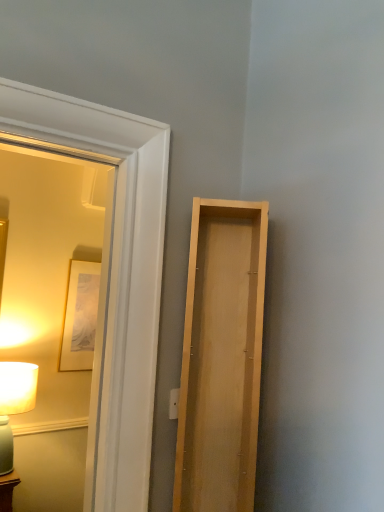
What is the approximate width of light wood door at right?

light wood door at right is 7.26 inches in width.

This screenshot has width=384, height=512. What do you see at coordinates (48, 313) in the screenshot? I see `matte wooden mirror at left` at bounding box center [48, 313].

This screenshot has width=384, height=512. Find the location of `light wood door at right`. light wood door at right is located at coordinates (221, 357).

Locate an element on the screen. Image resolution: width=384 pixels, height=512 pixels. door positioned vertically above the matte white lamp at left (from a real-world perspective) is located at coordinates (221, 357).

Is there a large distance between matte white lamp at left and light wood door at right?

Yes, matte white lamp at left is far from light wood door at right.

From a real-world perspective, is matte white lamp at left positioned above or below light wood door at right?

From a real-world perspective, matte white lamp at left is physically below light wood door at right.

From the picture: How different are the orientations of matte white lamp at left and light wood door at right in degrees?

The angle between the facing direction of matte white lamp at left and the facing direction of light wood door at right is 31.7 degrees.

How many degrees apart are the facing directions of matte wooden mirror at left and light wood door at right?

The facing directions of matte wooden mirror at left and light wood door at right are 32.5 degrees apart.

From the image's perspective, is matte wooden mirror at left beneath light wood door at right?

No, from the image's perspective, matte wooden mirror at left is not below light wood door at right.

From a real-world perspective, who is located lower, matte wooden mirror at left or light wood door at right?

light wood door at right is physically lower.

The image size is (384, 512). I want to click on mirror on the left of light wood door at right, so click(48, 313).

Considering the sizes of objects matte white lamp at left and matte wooden mirror at left in the image provided, who is thinner, matte white lamp at left or matte wooden mirror at left?

With smaller width is matte wooden mirror at left.

Measure the distance from matte white lamp at left to matte wooden mirror at left.

matte white lamp at left is 21.87 inches away from matte wooden mirror at left.

What are the coordinates of `table lamp below the matte wooden mirror at left (from a real-world perspective)` in the screenshot? It's located at (14, 403).

Who is bigger, matte white lamp at left or matte wooden mirror at left?

Bigger between the two is matte wooden mirror at left.

Consider the image. Is there a large distance between light wood door at right and matte wooden mirror at left?

That's right, there is a large distance between light wood door at right and matte wooden mirror at left.

Would you say light wood door at right is to the left or to the right of matte wooden mirror at left in the picture?

Clearly, light wood door at right is on the right of matte wooden mirror at left in the image.

Are matte wooden mirror at left and matte white lamp at left beside each other?

No, matte wooden mirror at left is not in contact with matte white lamp at left.

Can you tell me how much matte wooden mirror at left and matte white lamp at left differ in facing direction?

The facing directions of matte wooden mirror at left and matte white lamp at left are 0.854 degrees apart.

Based on the photo, from a real-world perspective, between matte wooden mirror at left and matte white lamp at left, who is vertically lower?

In real-world perspective, matte white lamp at left is lower.

This screenshot has height=512, width=384. In order to click on mirror above the matte white lamp at left (from the image's perspective) in this screenshot , I will do `click(48, 313)`.

Are light wood door at right and matte white lamp at left far apart?

Indeed, light wood door at right is not near matte white lamp at left.

Does light wood door at right have a greater width compared to matte white lamp at left?

Incorrect, the width of light wood door at right does not surpass that of matte white lamp at left.

Does light wood door at right appear on the right side of matte white lamp at left?

Yes.

What's the angular difference between light wood door at right and matte white lamp at left's facing directions?

The facing directions of light wood door at right and matte white lamp at left are 31.7 degrees apart.

Find the location of a particular element. The height and width of the screenshot is (512, 384). door above the matte white lamp at left (from a real-world perspective) is located at coordinates (221, 357).

Identify the location of door on the right of the matte wooden mirror at left. This screenshot has width=384, height=512. (221, 357).

Which object lies nearer to the anchor point matte wooden mirror at left, matte white lamp at left or light wood door at right?

Among the two, matte white lamp at left is located nearer to matte wooden mirror at left.

Which object lies further to the anchor point light wood door at right, matte white lamp at left or matte wooden mirror at left?

Based on the image, matte wooden mirror at left appears to be further to light wood door at right.

Which object lies further to the anchor point light wood door at right, matte wooden mirror at left or matte white lamp at left?

Based on the image, matte wooden mirror at left appears to be further to light wood door at right.

From the image, which object appears to be nearer to matte white lamp at left, light wood door at right or matte wooden mirror at left?

matte wooden mirror at left is positioned closer to the anchor matte white lamp at left.

When comparing their distances from matte white lamp at left, does matte wooden mirror at left or light wood door at right seem further?

Based on the image, light wood door at right appears to be further to matte white lamp at left.

Which object lies further to the anchor point matte wooden mirror at left, light wood door at right or matte white lamp at left?

Answer: Among the two, light wood door at right is located further to matte wooden mirror at left.

The image size is (384, 512). I want to click on door between matte wooden mirror at left and matte white lamp at left in the front-back direction, so click(221, 357).